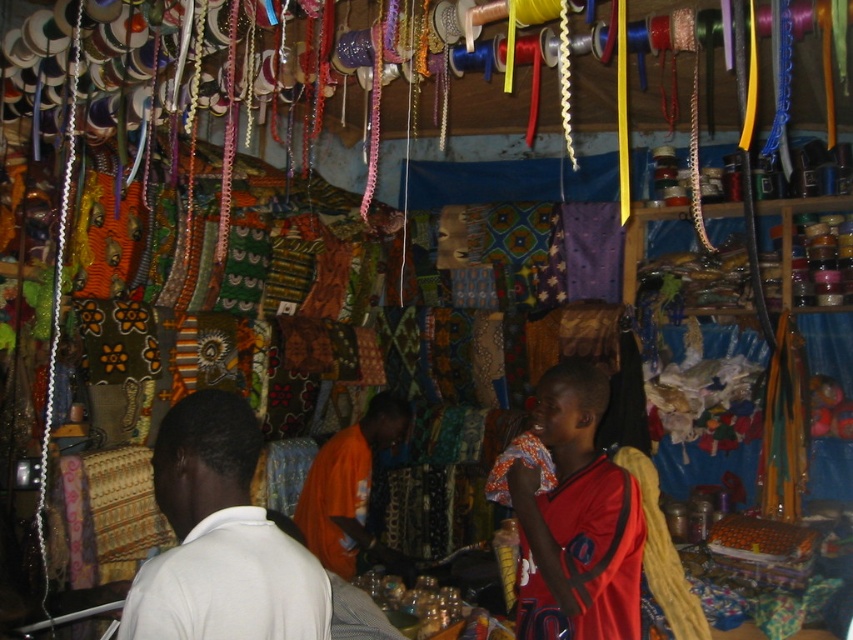
Does white matte shirt at center come behind orange fabric at center?

No, it is in front of orange fabric at center.

Which is in front, point (219, 497) or point (343, 488)?

Positioned in front is point (219, 497).

Who is more forward, (282, 632) or (317, 541)?

Point (282, 632)

Where is `white matte shirt at center`? white matte shirt at center is located at coordinates (219, 538).

Is red jersey at center shorter than orange fabric at center?

Yes.

This screenshot has height=640, width=853. What do you see at coordinates (576, 520) in the screenshot?
I see `red jersey at center` at bounding box center [576, 520].

Image resolution: width=853 pixels, height=640 pixels. In order to click on red jersey at center in this screenshot , I will do `click(576, 520)`.

Is white matte shirt at center positioned behind red jersey at center?

No.

Who is positioned more to the right, white matte shirt at center or red jersey at center?

Positioned to the right is red jersey at center.

The width and height of the screenshot is (853, 640). I want to click on white matte shirt at center, so click(x=219, y=538).

Where is `white matte shirt at center`? This screenshot has height=640, width=853. white matte shirt at center is located at coordinates (219, 538).